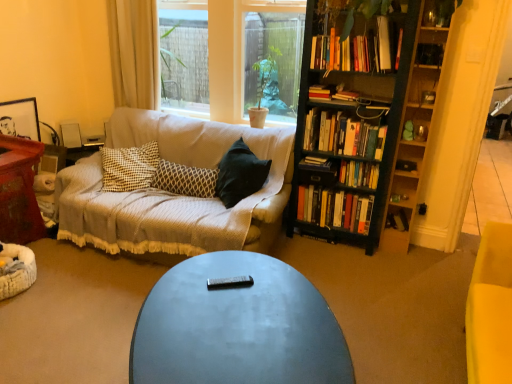
This screenshot has width=512, height=384. In order to click on free point above hardcover book at center, which is the fifth book in top-to-bottom order (from a real-world perspective) in this screenshot , I will do `click(317, 159)`.